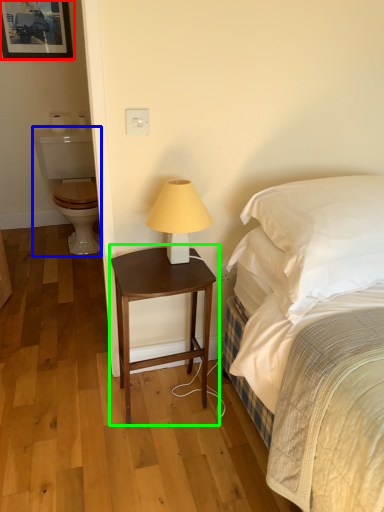
Question: Considering the real-world distances, which object is farthest from picture frame (highlighted by a red box)? sit (highlighted by a blue box) or nightstand (highlighted by a green box)?

Choices:
 (A) sit
 (B) nightstand

Answer: (B)